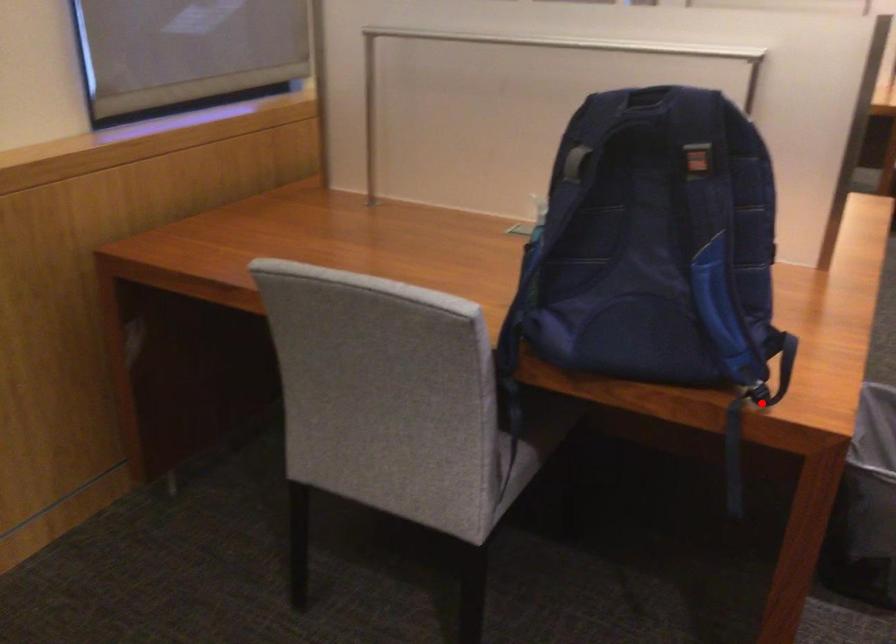
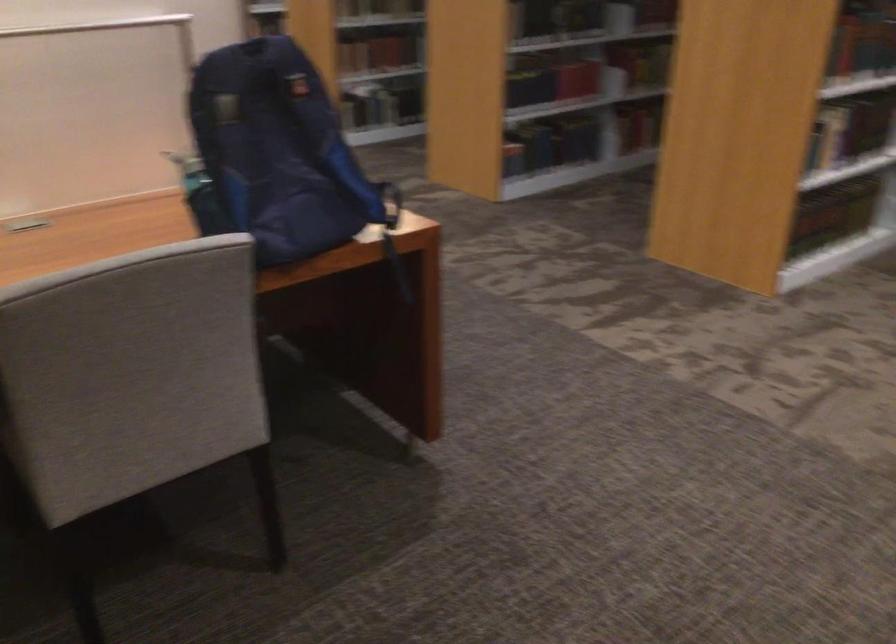
Question: I am providing you with two images of the same scene from different viewpoints. Image1 has a red point marked. In image2, the corresponding 3D location appears at what relative position? Reply with the corresponding letter.

Choices:
 (A) Closer
 (B) Farther

Answer: (B)